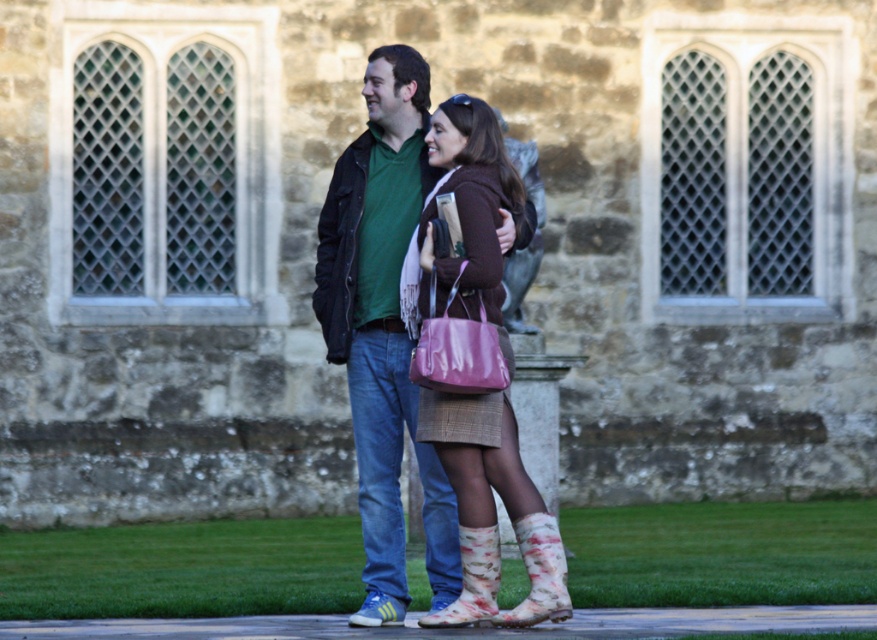
You are a photographer trying to capture a photo of the matte green shirt at center and the floral fabric boot at lower center. Since you want to ensure both are in focus, you need to know their heights. Which object is taller?

The matte green shirt at center is much taller than the floral fabric boot at lower center, so you should adjust your camera settings accordingly to capture both in focus.

Based on the photo, you are standing at the camera position and want to reach point [471,573]. Is this point within a comfortable walking distance?

The distance between point [471,573] and the camera is 99.91 feet, which is a long distance. It might not be considered a comfortable walking distance for a short walk, but it depends on the individual.